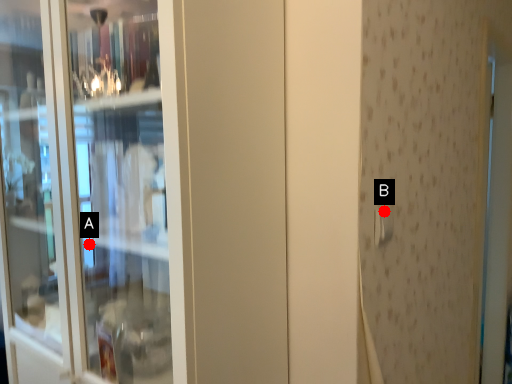
Question: Two points are circled on the image, labeled by A and B beside each circle. Which point appears farthest from the camera in this image?

Choices:
 (A) A is further
 (B) B is further

Answer: (A)